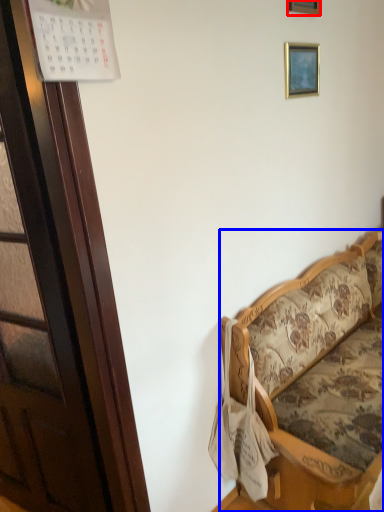
Question: Which of the following is the closest to the observer, picture frame (highlighted by a red box) or studio couch (highlighted by a blue box)?

Choices:
 (A) picture frame
 (B) studio couch

Answer: (B)